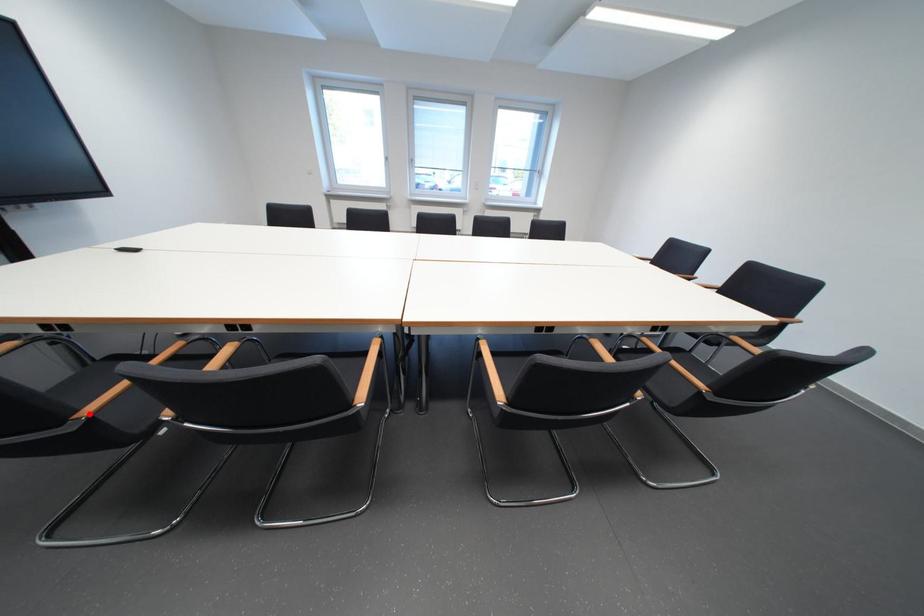
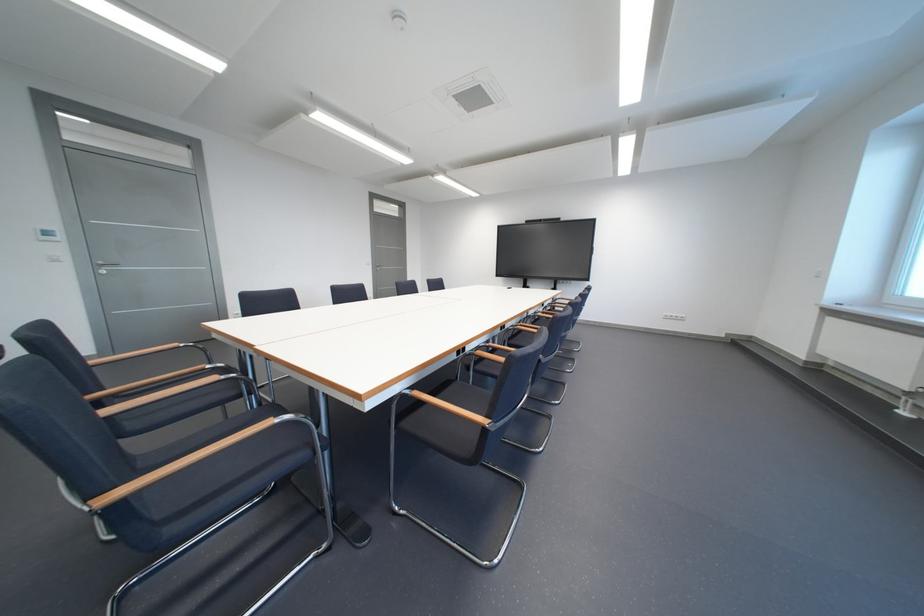
Question: I am providing you with two images of the same scene from different viewpoints. A red point is marked on the first image. Is the red point's position out of view in image 2?

Choices:
 (A) Yes
 (B) No

Answer: (A)